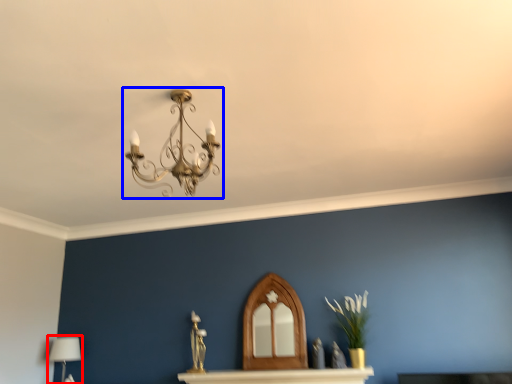
Question: Among these objects, which one is farthest to the camera, table lamp (highlighted by a red box) or lamp (highlighted by a blue box)?

Choices:
 (A) table lamp
 (B) lamp

Answer: (A)